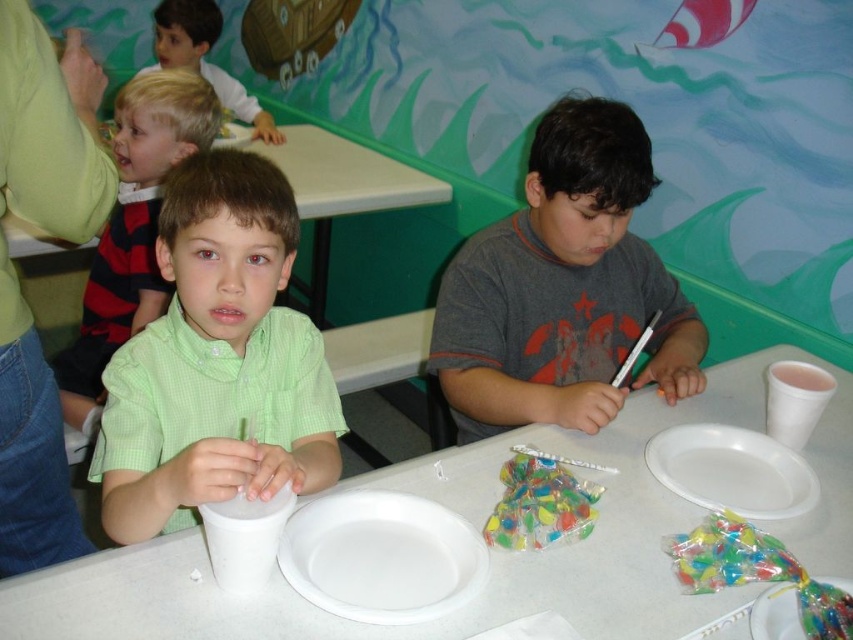
Between translucent plastic candy at lower right and white paper cup at upper right, which one has more height?

white paper cup at upper right

Does translucent plastic candy at lower right come in front of white paper cup at upper right?

Yes, it is.

Image resolution: width=853 pixels, height=640 pixels. Identify the location of translucent plastic candy at lower right. (728, 556).

Which is more to the left, translucent plastic candy at center or white matte paper cup at lower left?

white matte paper cup at lower left is more to the left.

Is translucent plastic candy at center positioned at the back of white matte paper cup at lower left?

Yes, it is.

The image size is (853, 640). What do you see at coordinates (538, 504) in the screenshot?
I see `translucent plastic candy at center` at bounding box center [538, 504].

Where is `translucent plastic candy at center`? The height and width of the screenshot is (640, 853). translucent plastic candy at center is located at coordinates (538, 504).

Between point (335, 630) and point (422, 522), which one is positioned behind?

The point (422, 522) is behind.

Does white plastic table at center appear over white paper plate at center?

Indeed, white plastic table at center is positioned over white paper plate at center.

Locate an element on the screen. The image size is (853, 640). white plastic table at center is located at coordinates (479, 529).

Locate an element on the screen. This screenshot has height=640, width=853. white plastic table at center is located at coordinates (479, 529).